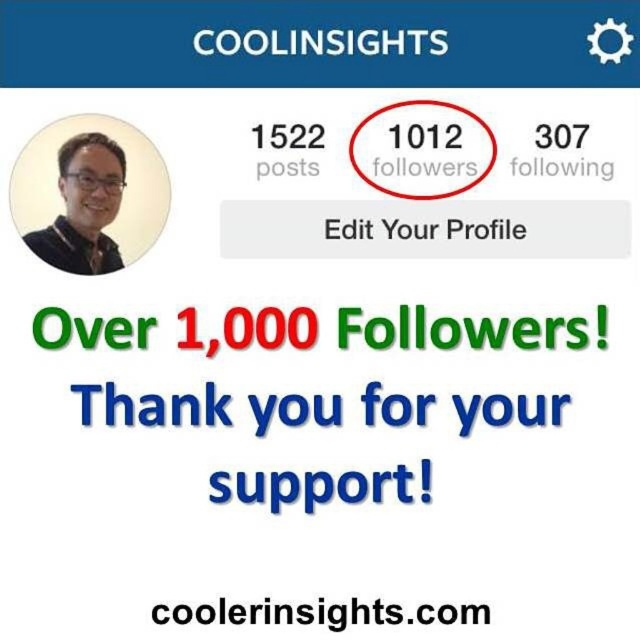
You are looking at a social media profile and notice the matte black glasses at upper left and the black text at center. Which of these two elements is narrower in width?

The matte black glasses at upper left has a lesser width compared to the black text at center, so the matte black glasses at upper left is narrower in width.

What are the coordinates of the matte black glasses at upper left in the image?

The coordinates of the matte black glasses at upper left are at point (84, 208).